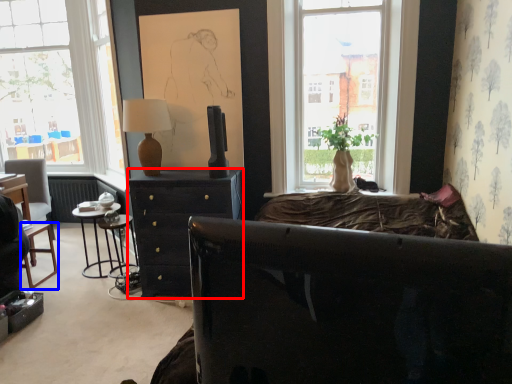
Question: Which of the following is the farthest to the observer, desk (highlighted by a red box) or bar stool (highlighted by a blue box)?

Choices:
 (A) desk
 (B) bar stool

Answer: (B)